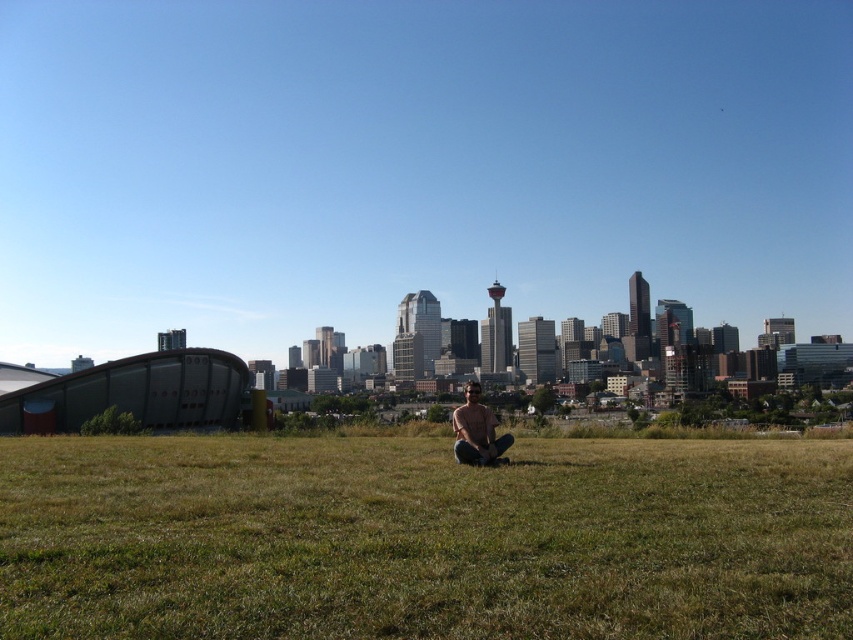
You are planning to lay down a picnic blanket on the green grass at center and light brown skin at center. Which area has enough space to accommodate the blanket?

The green grass at center has a greater width than the light brown skin at center, so it can accommodate the picnic blanket more comfortably.

You are standing on the green grass at center and want to move to the light brown skin at center. In which direction should you walk?

The green grass at center is to the left of light brown skin at center, so you should walk to the right to reach the light brown skin at center.